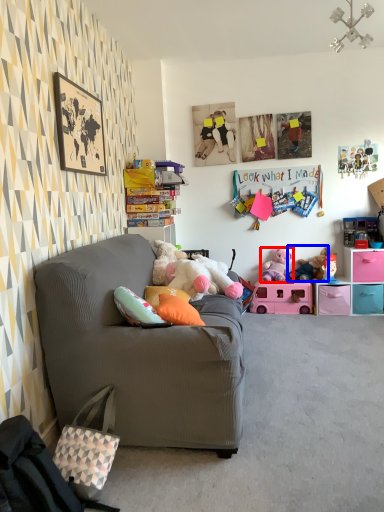
Question: Which object appears closest to the camera in this image, toy (highlighted by a red box) or toy (highlighted by a blue box)?

Choices:
 (A) toy
 (B) toy

Answer: (B)